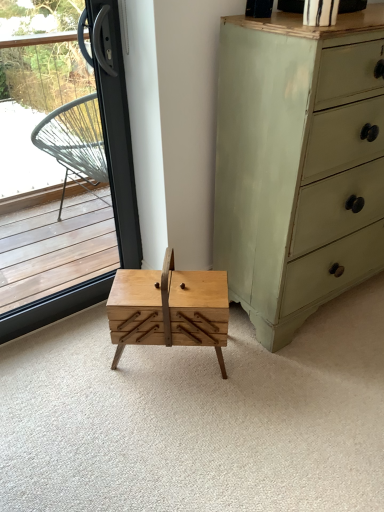
In order to click on free space to the left of natural wood table at center in this screenshot , I will do `click(87, 366)`.